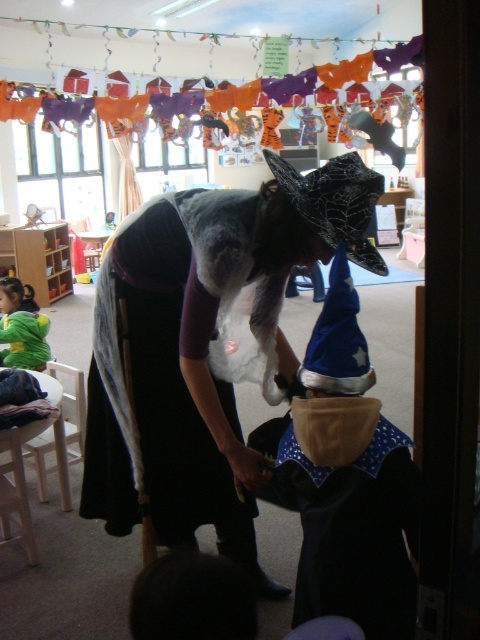
You are a student in the classroom and you need to find the blue felt hat at center and the green fuzzy sweater at lower left. Which object is located more to the right side of the room?

The blue felt hat at center is positioned on the right side of the green fuzzy sweater at lower left, so the blue felt hat at center is more to the right.

You are organizing a Halloween costume party and need to ensure that all costumes fit through a narrow doorway. Given that the velvet black cape at center and the green fuzzy sweater at lower left are part of two different costumes, which costume requires more space due to its wider garment?

The velvet black cape at center requires more space because its width is larger than the green fuzzy sweater at lower left.